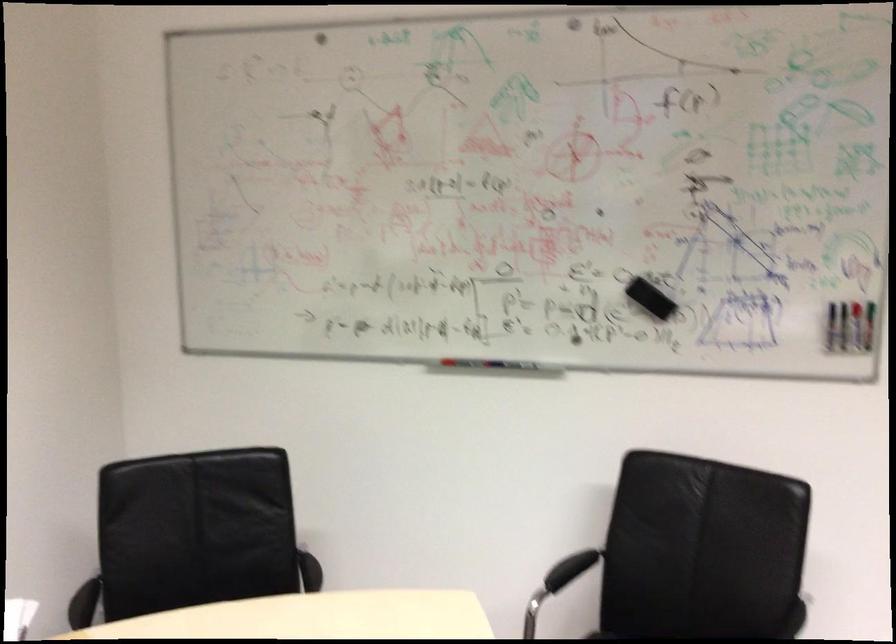
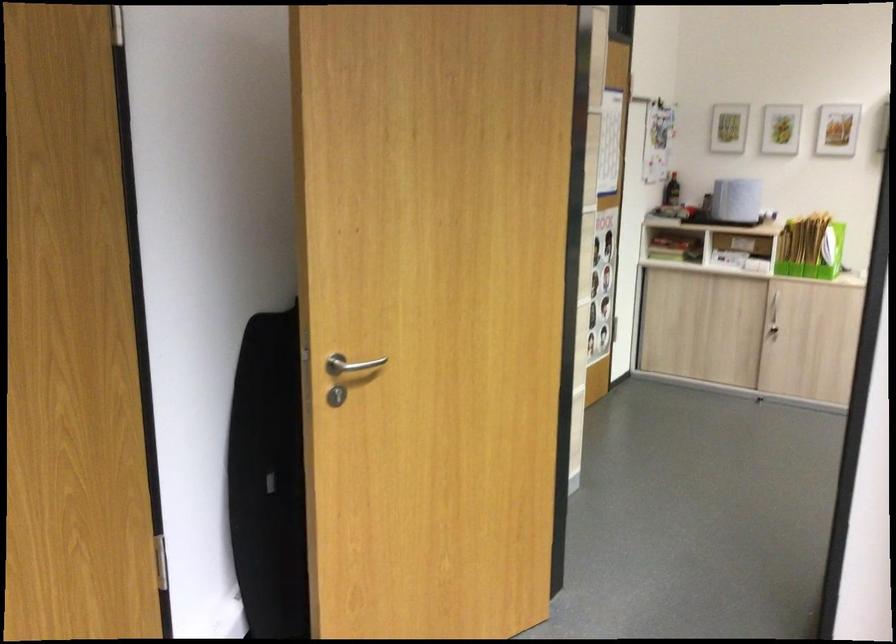
Question: The camera is either moving clockwise (left) or counter-clockwise (right) around the object. The first image is from the beginning of the video and the second image is from the end. Is the camera moving left or right when shooting the video?

Choices:
 (A) Left
 (B) Right

Answer: (A)